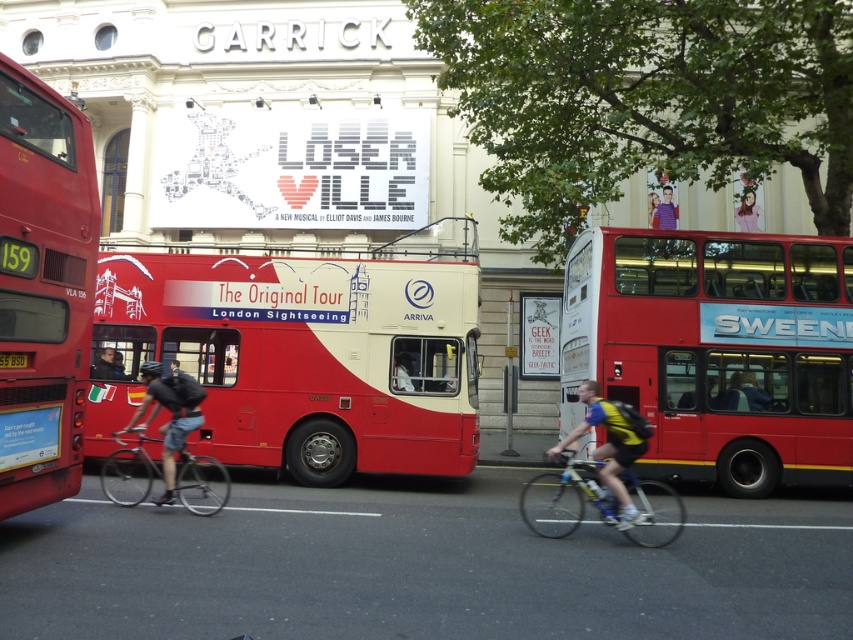
Question: From the image, what is the correct spatial relationship of red matte bus at center in relation to yellow and blue cycling jersey at center?

Choices:
 (A) left
 (B) right

Answer: (A)

Question: Which point is closer to the camera?

Choices:
 (A) (567, 525)
 (B) (175, 440)
 (C) (151, 472)

Answer: (A)

Question: Which point is farther to the camera?

Choices:
 (A) (28, 236)
 (B) (125, 497)

Answer: (B)

Question: Estimate the real-world distances between objects in this image. Which object is closer to the matte black bicycle at center?

Choices:
 (A) smooth plastic face at upper right
 (B) red matte double-decker bus at right
 (C) silver metallic bicycle at center
 (D) red matte double-decker bus at left

Answer: (C)

Question: Is yellow and blue cycling jersey at center below purple fabric shirt at upper center?

Choices:
 (A) no
 (B) yes

Answer: (B)

Question: Observing the image, what is the correct spatial positioning of red matte bus at center in reference to matte black bicycle at center?

Choices:
 (A) left
 (B) right

Answer: (A)